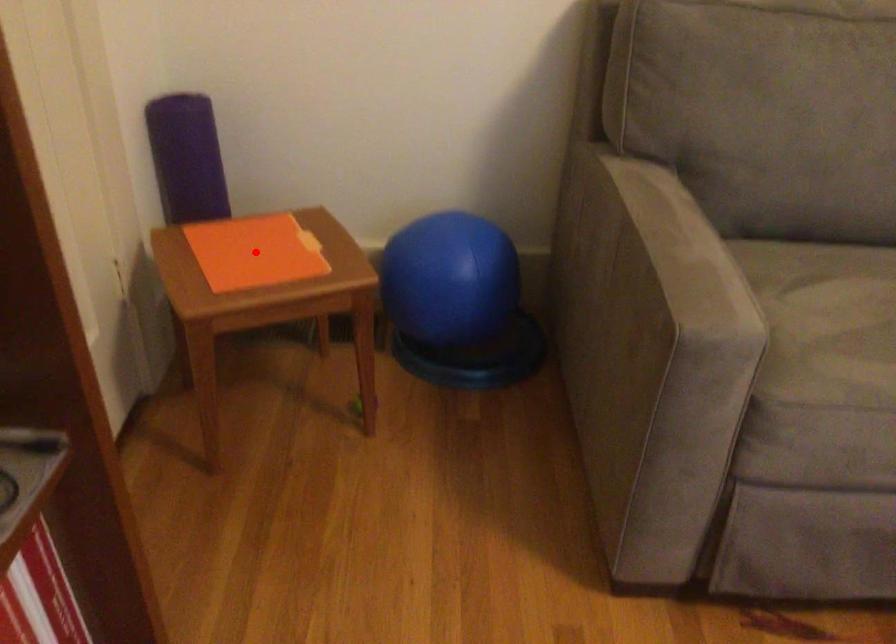
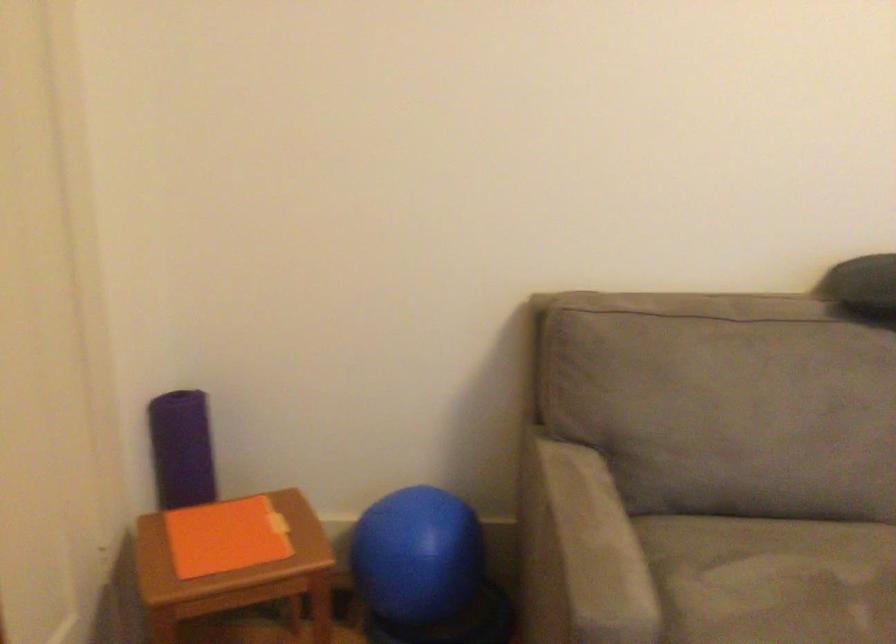
Find the pixel in the second image that matches the highlighted location in the first image.

(226, 536)